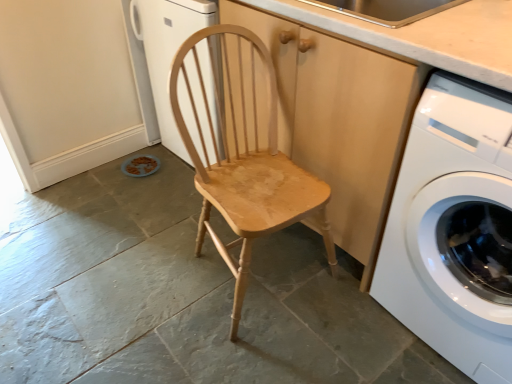
Question: From the image's perspective, is white glossy washing machine at right above light brown wood at upper center?

Choices:
 (A) yes
 (B) no

Answer: (B)

Question: From the image's perspective, would you say white glossy washing machine at right is shown under light brown wood at upper center?

Choices:
 (A) no
 (B) yes

Answer: (B)

Question: Is white glossy washing machine at right oriented away from light brown wood at upper center?

Choices:
 (A) yes
 (B) no

Answer: (B)

Question: Does white glossy washing machine at right turn towards light brown wood at upper center?

Choices:
 (A) no
 (B) yes

Answer: (A)

Question: Can you confirm if white glossy washing machine at right is shorter than light brown wood at upper center?

Choices:
 (A) no
 (B) yes

Answer: (A)

Question: Can you confirm if white glossy washing machine at right is bigger than light brown wood at upper center?

Choices:
 (A) yes
 (B) no

Answer: (A)

Question: Is the surface of white glossy washing machine at right in direct contact with wooden cabinet at center?

Choices:
 (A) no
 (B) yes

Answer: (A)

Question: Is white glossy washing machine at right to the left of wooden cabinet at center from the viewer's perspective?

Choices:
 (A) yes
 (B) no

Answer: (B)

Question: From a real-world perspective, is white glossy washing machine at right physically above wooden cabinet at center?

Choices:
 (A) yes
 (B) no

Answer: (B)

Question: Would you say white glossy washing machine at right contains wooden cabinet at center?

Choices:
 (A) yes
 (B) no

Answer: (B)

Question: Is white glossy washing machine at right smaller than wooden cabinet at center?

Choices:
 (A) yes
 (B) no

Answer: (A)

Question: From the image's perspective, is white glossy washing machine at right on wooden cabinet at center?

Choices:
 (A) yes
 (B) no

Answer: (B)

Question: From a real-world perspective, is natural wood chair at center located higher than white glossy washing machine at right?

Choices:
 (A) yes
 (B) no

Answer: (B)